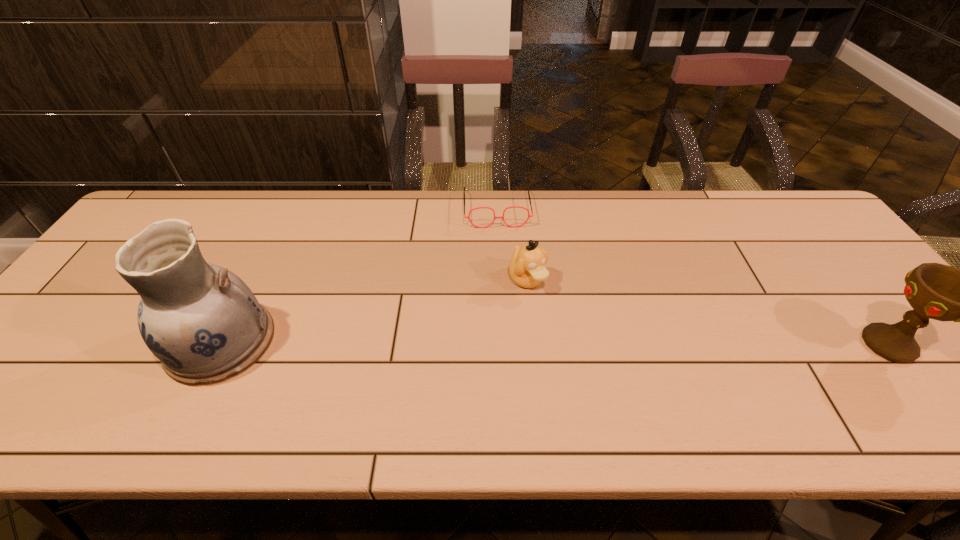
The width and height of the screenshot is (960, 540). I want to click on object that is at the near right corner, so tap(936, 291).

You are a GUI agent. You are given a task and a screenshot of the screen. Output one action in this format:
    pyautogui.click(x=<x>, y=<y>)
    Task: Click on the blank space at the far edge
    This screenshot has width=960, height=540.
    Given the screenshot: What is the action you would take?
    pyautogui.click(x=263, y=212)

Where is `free location at the near edge`? The image size is (960, 540). free location at the near edge is located at coordinates (795, 371).

Find the location of a particular element. The width and height of the screenshot is (960, 540). vacant space at the left edge is located at coordinates (58, 332).

This screenshot has width=960, height=540. In the image, there is a desktop. In order to click on free space at the right edge in this screenshot , I will do `click(796, 251)`.

The width and height of the screenshot is (960, 540). I want to click on vacant space at the far left corner of the desktop, so click(177, 199).

Locate an element on the screen. Image resolution: width=960 pixels, height=540 pixels. free space at the near left corner of the desktop is located at coordinates [89, 366].

In the image, there is a desktop. Where is `free space at the far right corner`? free space at the far right corner is located at coordinates (758, 199).

Locate an element on the screen. vacant area at the near right corner is located at coordinates (928, 388).

Find the location of `vacant space that's between the pottery and the shortest object`. vacant space that's between the pottery and the shortest object is located at coordinates (359, 275).